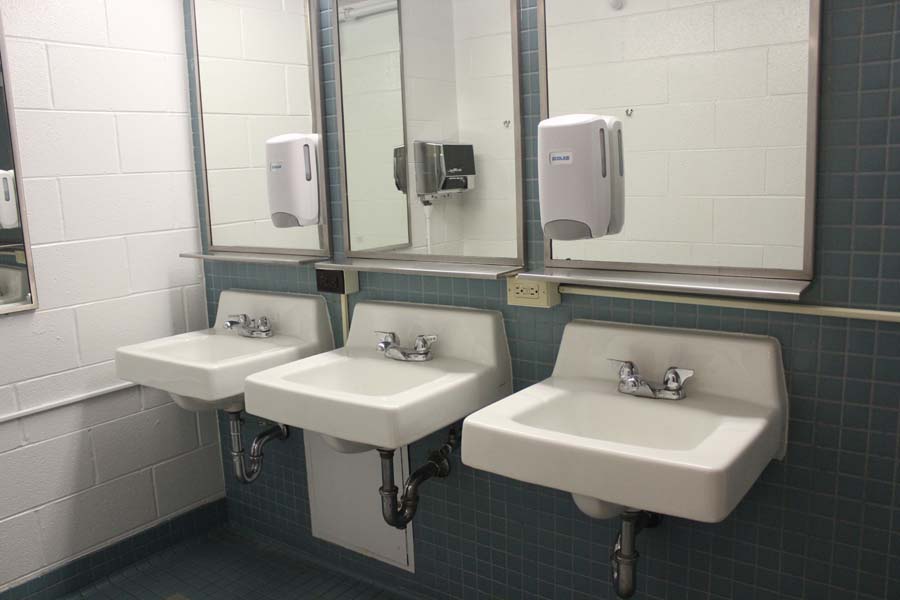
Find the location of a particular element. sink is located at coordinates (217, 349), (370, 387), (615, 428).